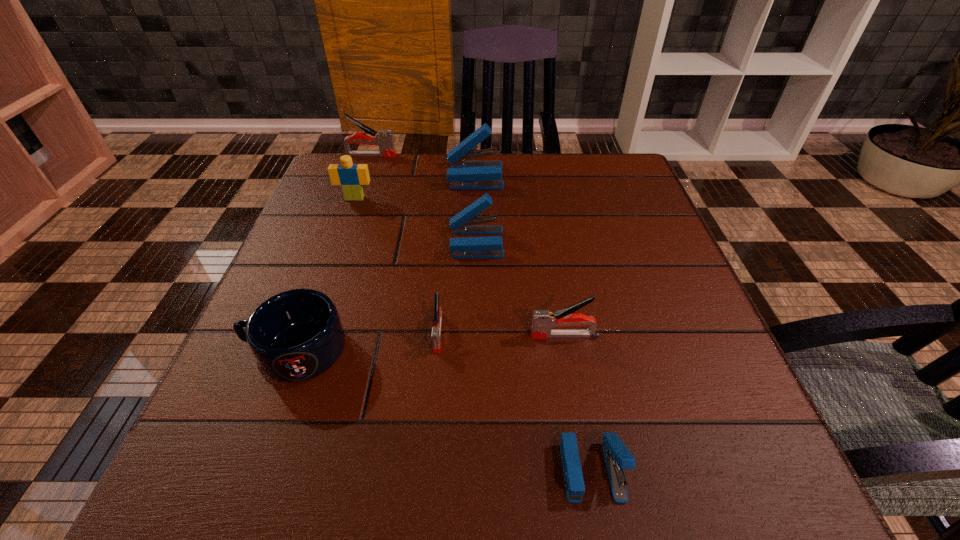
Identify the location of blue stapler identified as the closest to the biggest blue stapler. The image size is (960, 540). pos(464,222).

The width and height of the screenshot is (960, 540). I want to click on free space that satisfies the following two spatial constraints: 1. on the handle side of the second gray stapler from left to right; 2. with the handle on the side of the blue mug, so click(437, 350).

Where is `vacant point that satisfies the following two spatial constraints: 1. with the handle on the side of the nearest blue stapler; 2. on the right side of the blue mug`? The image size is (960, 540). vacant point that satisfies the following two spatial constraints: 1. with the handle on the side of the nearest blue stapler; 2. on the right side of the blue mug is located at coordinates (252, 469).

Locate an element on the screen. This screenshot has height=540, width=960. vacant position in the image that satisfies the following two spatial constraints: 1. on the handle side of the nearest blue stapler; 2. on the right side of the second smallest gray stapler is located at coordinates (588, 469).

Identify the location of vacant area in the image that satisfies the following two spatial constraints: 1. on the handle side of the nearest object; 2. on the right side of the second gray stapler from left to right. (426, 469).

Find the location of a particular element. vacant region that satisfies the following two spatial constraints: 1. on the handle side of the rightmost blue stapler; 2. on the right side of the second smallest gray stapler is located at coordinates (588, 469).